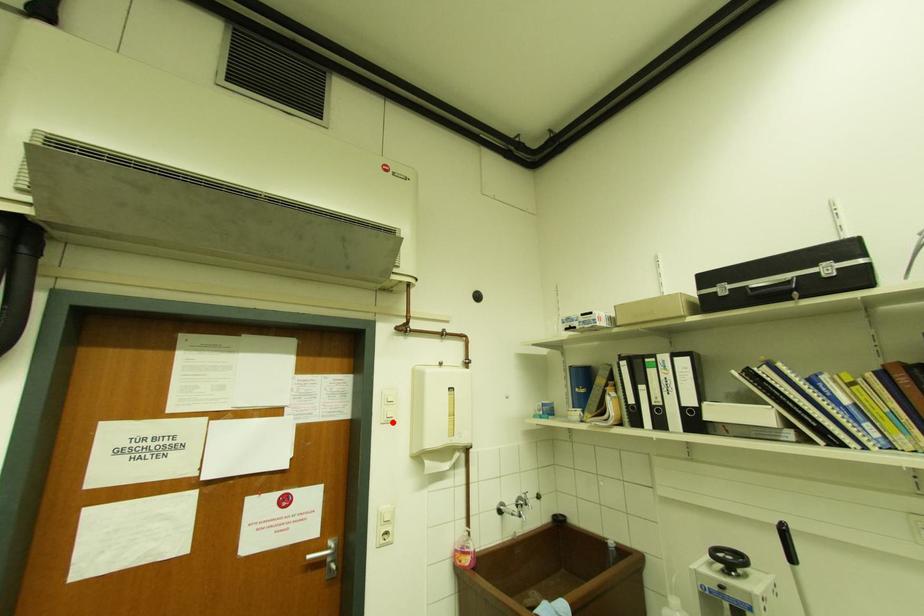
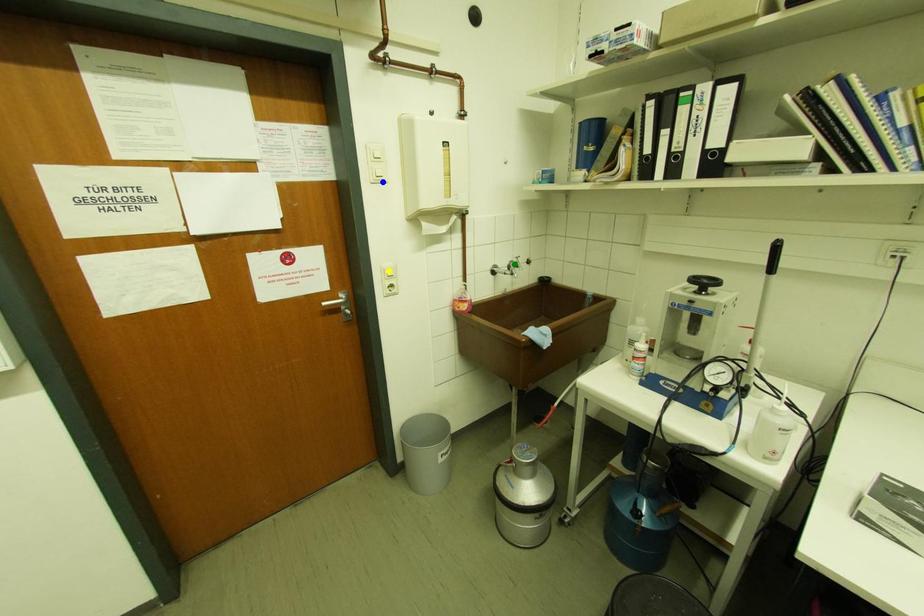
Question: I am providing you with two images of the same scene from different viewpoints. A red point is marked on the first image. You are given multiple points on the second image. Which mark in image 2 goes with the point in image 1?

Choices:
 (A) yellow point
 (B) blue point
 (C) green point

Answer: (B)